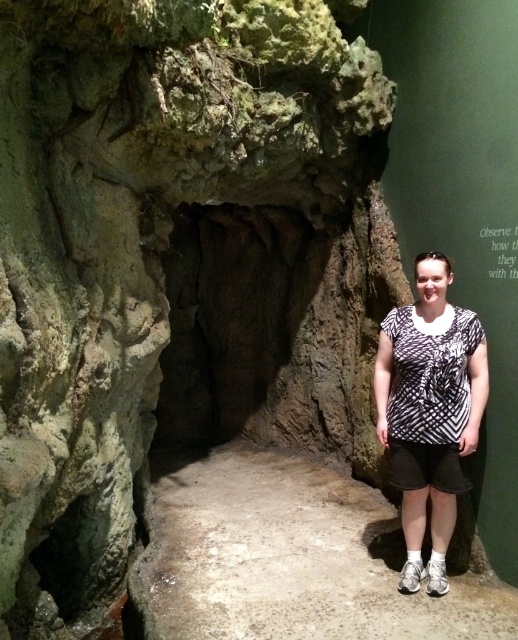
You are an exhibit designer planning to place a mannequin wearing a printed fabric shirt at center and a black and white printed shirt at center in the cave entrance. Which shirt will appear bigger in the exhibit?

The printed fabric shirt at center will appear bigger in the exhibit as it has a larger size compared to the black and white printed shirt at center.